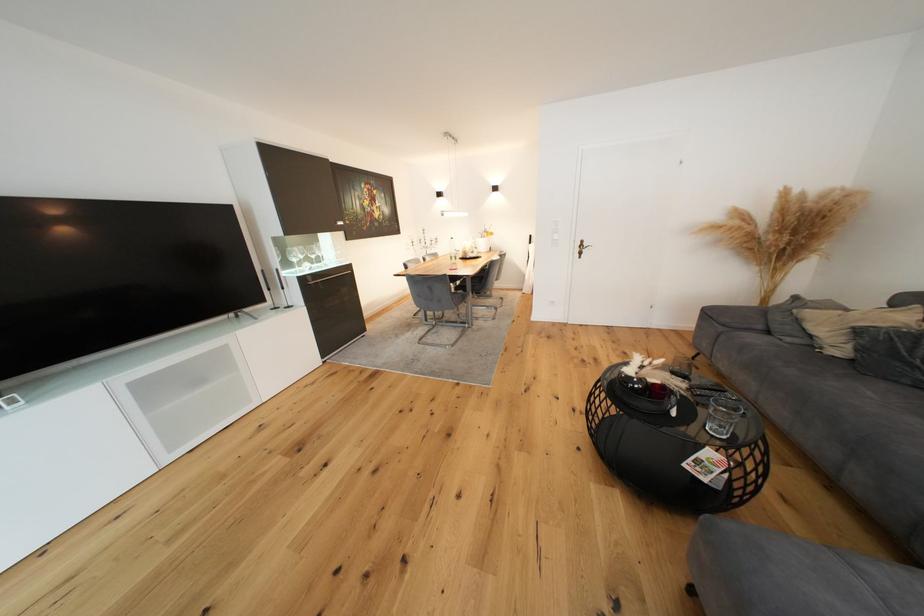
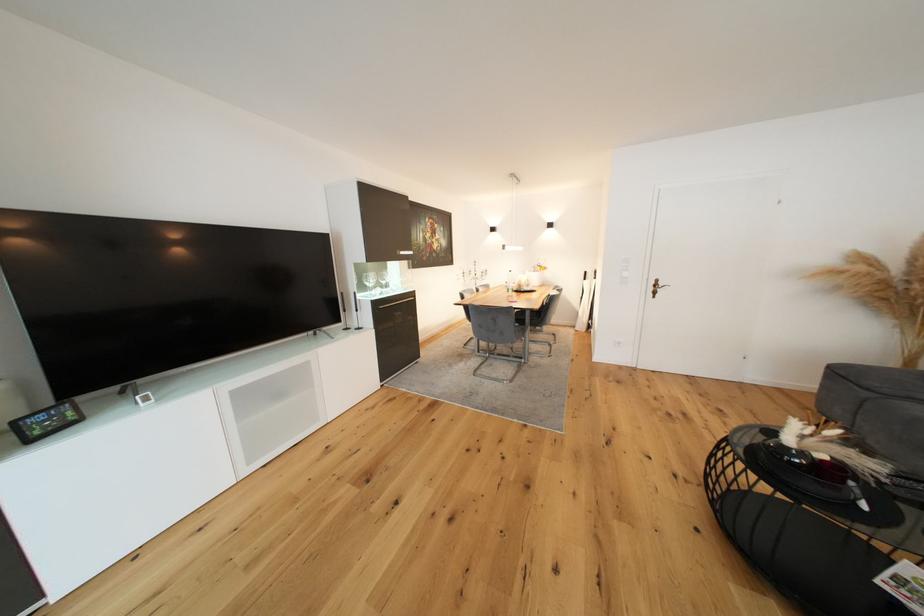
Find the pixel in the second image that matches (730,326) in the first image.

(874, 391)